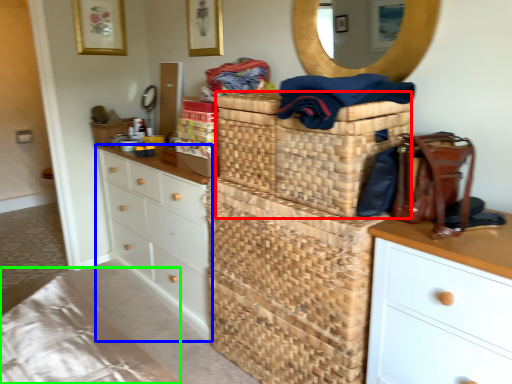
Question: Which object is the closest to the basket (highlighted by a red box)? Choose among these: chest of drawers (highlighted by a blue box) or bedding (highlighted by a green box).

Choices:
 (A) chest of drawers
 (B) bedding

Answer: (A)